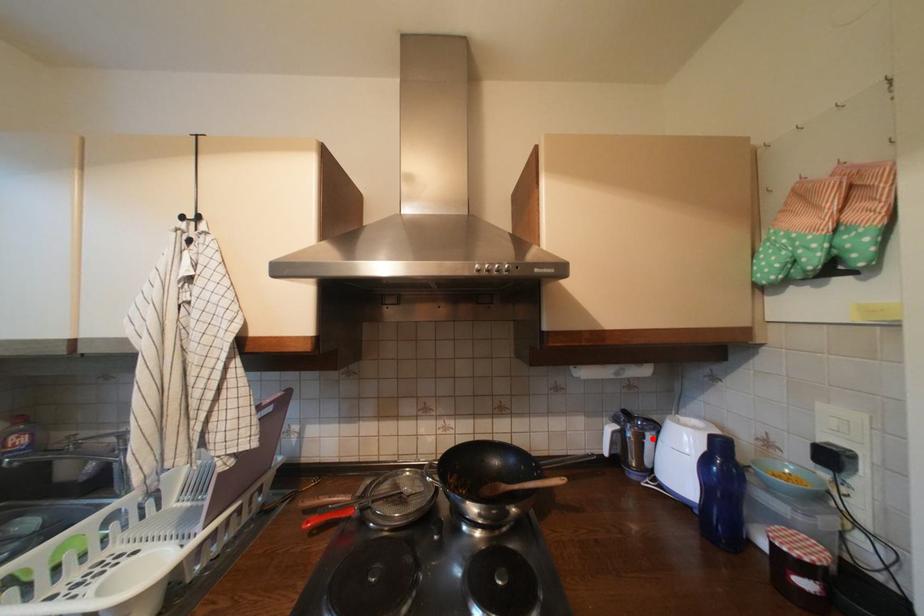
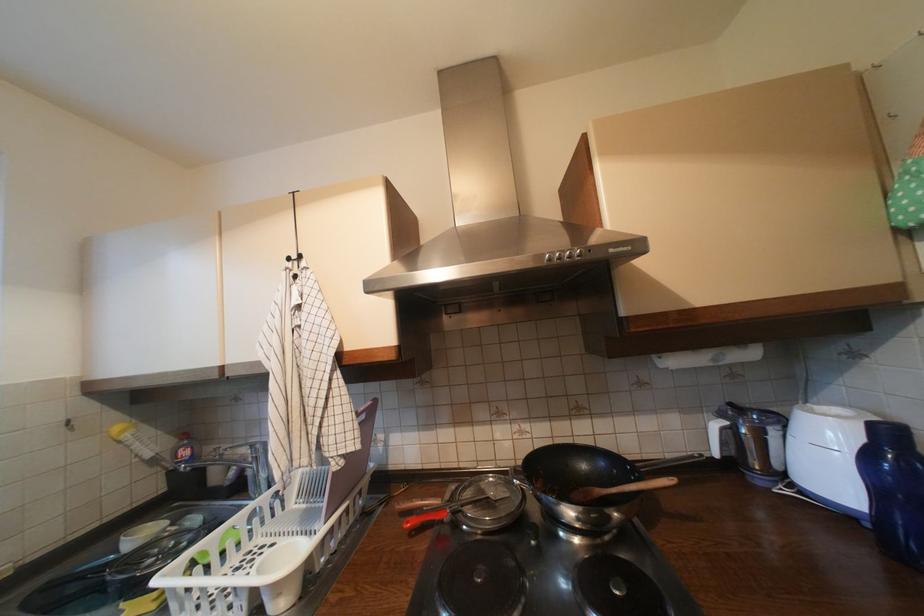
Locate, in the second image, the point that corresponds to the highlighted location in the first image.

(774, 435)